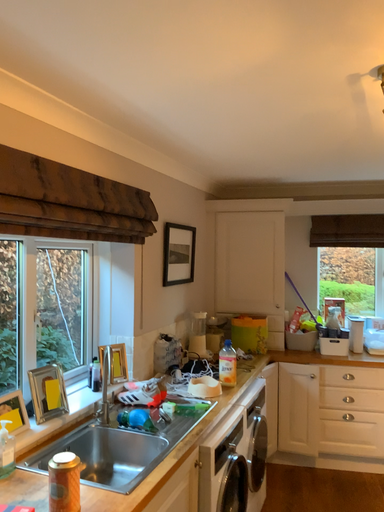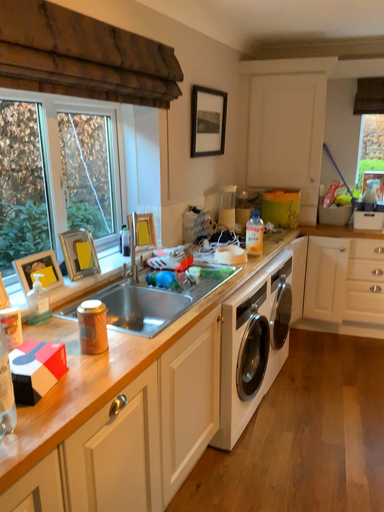
Question: Which way did the camera rotate in the video?

Choices:
 (A) rotated downward
 (B) rotated upward

Answer: (A)